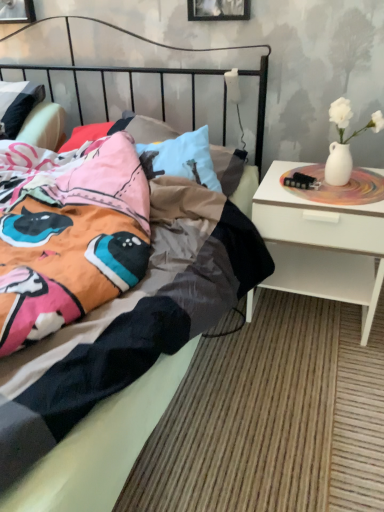
Question: Does black matte picture frame at upper center, the second picture frame from the left, appear on the left side of metallic silver picture frame at upper left, the 1th picture frame in the back-to-front sequence?

Choices:
 (A) yes
 (B) no

Answer: (B)

Question: Does black matte picture frame at upper center, which ranks as the 1th picture frame in front-to-back order, have a lesser height compared to metallic silver picture frame at upper left, arranged as the 2th picture frame when viewed from the right?

Choices:
 (A) yes
 (B) no

Answer: (B)

Question: Is black matte picture frame at upper center, which ranks as the 1th picture frame in front-to-back order, oriented away from metallic silver picture frame at upper left, placed as the second picture frame when sorted from front to back?

Choices:
 (A) no
 (B) yes

Answer: (A)

Question: Are black matte picture frame at upper center, positioned as the first picture frame in right-to-left order, and metallic silver picture frame at upper left, arranged as the first picture frame when viewed from the left, far apart?

Choices:
 (A) yes
 (B) no

Answer: (B)

Question: Is black matte picture frame at upper center, positioned as the first picture frame in right-to-left order, further to camera compared to metallic silver picture frame at upper left, placed as the second picture frame when sorted from front to back?

Choices:
 (A) no
 (B) yes

Answer: (A)

Question: Is white glossy nightstand at right taller or shorter than black matte picture frame at upper center, the second picture frame from the left?

Choices:
 (A) short
 (B) tall

Answer: (B)

Question: Considering the positions of white glossy nightstand at right and black matte picture frame at upper center, the second picture frame from the left, in the image, is white glossy nightstand at right wider or thinner than black matte picture frame at upper center, the second picture frame from the left,?

Choices:
 (A) wide
 (B) thin

Answer: (A)

Question: From a real-world perspective, is white glossy nightstand at right positioned above or below black matte picture frame at upper center, positioned as the first picture frame in right-to-left order?

Choices:
 (A) above
 (B) below

Answer: (B)

Question: Is point (276, 240) closer or farther from the camera than point (218, 14)?

Choices:
 (A) farther
 (B) closer

Answer: (B)

Question: Does point (297, 237) appear closer or farther from the camera than point (3, 8)?

Choices:
 (A) closer
 (B) farther

Answer: (A)

Question: Is white glossy nightstand at right in front of or behind metallic silver picture frame at upper left, arranged as the 2th picture frame when viewed from the right, in the image?

Choices:
 (A) front
 (B) behind

Answer: (A)

Question: From their relative heights in the image, would you say white glossy nightstand at right is taller or shorter than metallic silver picture frame at upper left, arranged as the first picture frame when viewed from the left?

Choices:
 (A) short
 (B) tall

Answer: (B)

Question: In the image, is white glossy nightstand at right on the left side or the right side of metallic silver picture frame at upper left, arranged as the 2th picture frame when viewed from the right?

Choices:
 (A) right
 (B) left

Answer: (A)

Question: Is black matte picture frame at upper center, the second picture frame from the left, taller or shorter than metallic silver picture frame at upper left, arranged as the 2th picture frame when viewed from the right?

Choices:
 (A) short
 (B) tall

Answer: (B)

Question: Would you say black matte picture frame at upper center, arranged as the second picture frame when viewed from the back, is inside or outside metallic silver picture frame at upper left, placed as the second picture frame when sorted from front to back?

Choices:
 (A) inside
 (B) outside

Answer: (B)